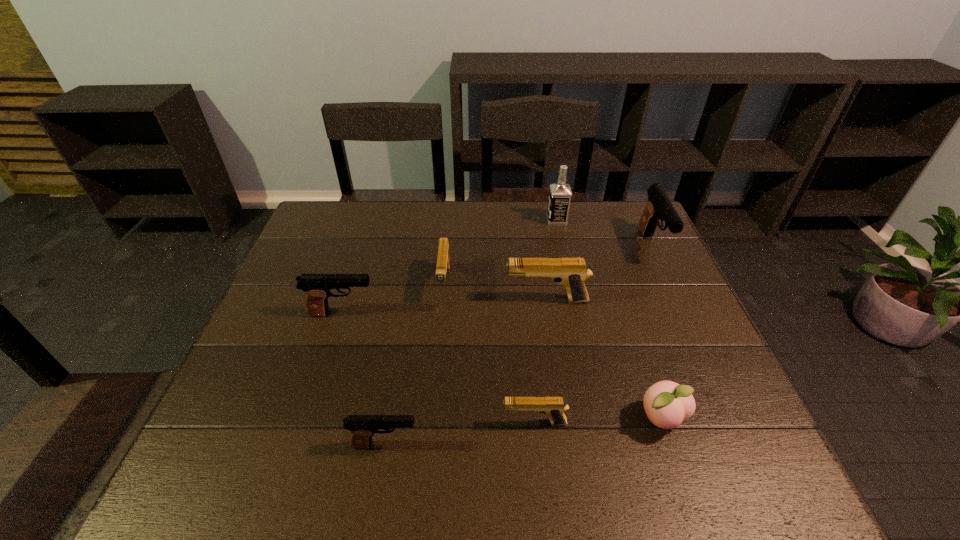
Locate an element on the screen. The height and width of the screenshot is (540, 960). vacant space located 0.310m at the barrel of the biggest tan pistol is located at coordinates (391, 300).

Locate an element on the screen. Image resolution: width=960 pixels, height=540 pixels. free region located 0.150m at the barrel of the leftmost object is located at coordinates (434, 314).

What are the coordinates of `free point located 0.170m at the barrel of the sixth object from right to left` in the screenshot? It's located at (438, 357).

I want to click on vacant space positioned 0.120m on the back of the pink peach, so click(x=640, y=355).

The height and width of the screenshot is (540, 960). Identify the location of free spot located at the barrel of the second pistol from left to right. (517, 445).

Locate an element on the screen. vacant point located at the barrel of the shortest object is located at coordinates (340, 423).

The image size is (960, 540). I want to click on vacant area situated at the barrel of the shortest object, so click(364, 423).

You are a GUI agent. You are given a task and a screenshot of the screen. Output one action in this format:
    pyautogui.click(x=<x>, y=<y>)
    Task: Click on the free region located 0.130m at the barrel of the shortest object
    The image size is (960, 540).
    Given the screenshot: What is the action you would take?
    pyautogui.click(x=441, y=423)

Locate an element on the screen. The width and height of the screenshot is (960, 540). vodka that is at the far edge is located at coordinates (560, 193).

Find the location of `pistol at the far edge`. pistol at the far edge is located at coordinates (659, 206).